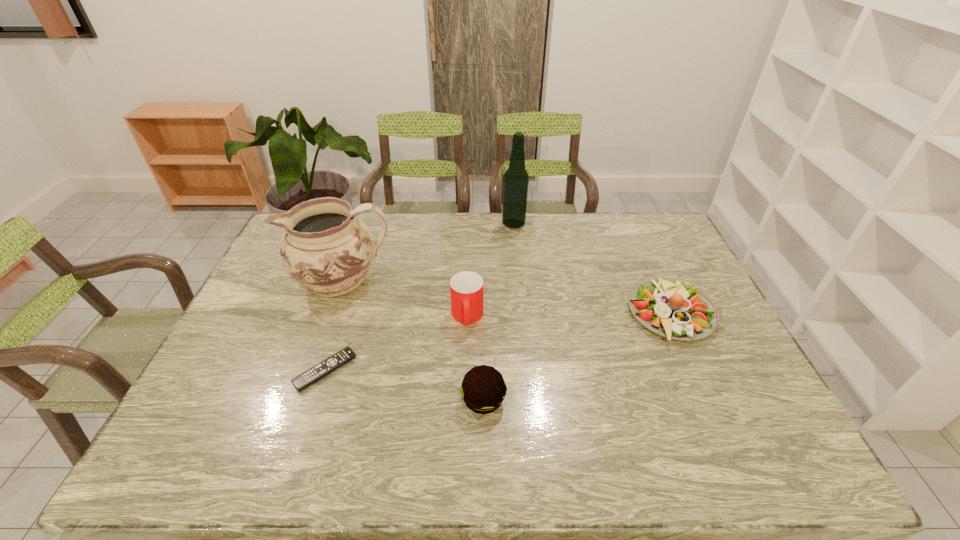
I want to click on blank area at the right edge, so click(680, 352).

The height and width of the screenshot is (540, 960). What are the coordinates of `vacant space at the far right corner` in the screenshot? It's located at (662, 228).

This screenshot has width=960, height=540. Identify the location of empty space between the patty and the alcohol. (498, 312).

Where is `free space between the salad plate and the remote control`? This screenshot has width=960, height=540. free space between the salad plate and the remote control is located at coordinates (498, 342).

Locate an element on the screen. This screenshot has height=540, width=960. vacant space that's between the fifth shortest object and the patty is located at coordinates (413, 340).

Locate an element on the screen. Image resolution: width=960 pixels, height=540 pixels. free space between the cup and the pitcher is located at coordinates tap(405, 299).

Where is `unoccupied area between the remote control and the patty`? unoccupied area between the remote control and the patty is located at coordinates (404, 385).

The image size is (960, 540). I want to click on free space between the cup and the alcohol, so click(491, 271).

This screenshot has height=540, width=960. I want to click on vacant point located between the patty and the remote control, so click(404, 385).

The image size is (960, 540). In order to click on free space between the rightmost object and the shortest object in this screenshot , I will do `click(498, 342)`.